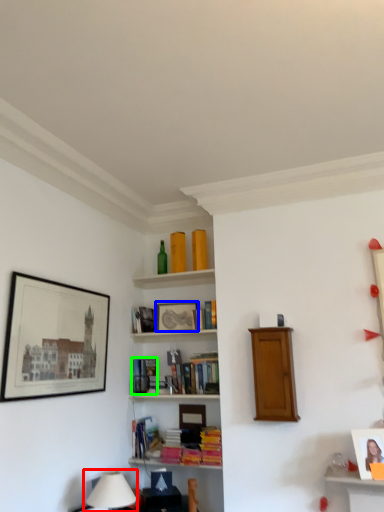
Question: Which object is positioned closest to table lamp (highlighted by a red box)? Select from picture frame (highlighted by a blue box) and book (highlighted by a green box).

Choices:
 (A) picture frame
 (B) book

Answer: (B)